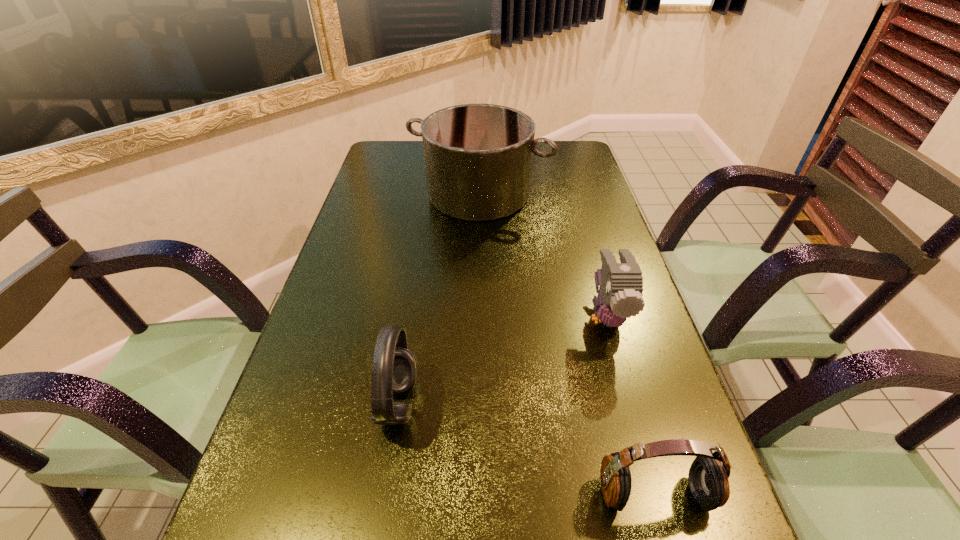
Locate an element on the screen. the farthest object is located at coordinates (478, 157).

Identify the location of the tallest object. (478, 157).

Where is `the left headset`? The height and width of the screenshot is (540, 960). the left headset is located at coordinates (394, 369).

Locate an element on the screen. the second nearest object is located at coordinates (394, 369).

Identify the location of the third nearest object. (619, 297).

Find the location of a particular element. Image resolution: width=960 pixels, height=540 pixels. the nearest object is located at coordinates (708, 475).

You are a GUI agent. You are given a task and a screenshot of the screen. Output one action in this format:
    pyautogui.click(x=<x>, y=<y>)
    Task: Click on the nearer headset
    The image size is (960, 540).
    Given the screenshot: What is the action you would take?
    pyautogui.click(x=708, y=475)

You are a GUI agent. You are given a task and a screenshot of the screen. Output one action in this format:
    pyautogui.click(x=<x>, y=<y>)
    Task: Click on the free space located 0.090m on the front of the pan
    The height and width of the screenshot is (540, 960).
    Given the screenshot: What is the action you would take?
    pyautogui.click(x=478, y=244)

Where is `vacant point located on the earcups of the farther headset`? This screenshot has height=540, width=960. vacant point located on the earcups of the farther headset is located at coordinates (503, 403).

The width and height of the screenshot is (960, 540). What are the coordinates of `free region located at the beak of the third nearest object` in the screenshot? It's located at (661, 508).